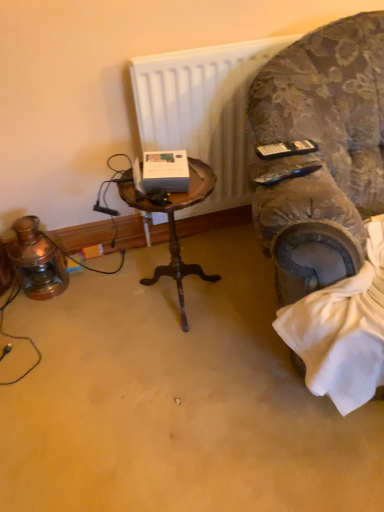
This screenshot has height=512, width=384. I want to click on free region under woodenobject at center (from a real-world perspective), so click(x=177, y=302).